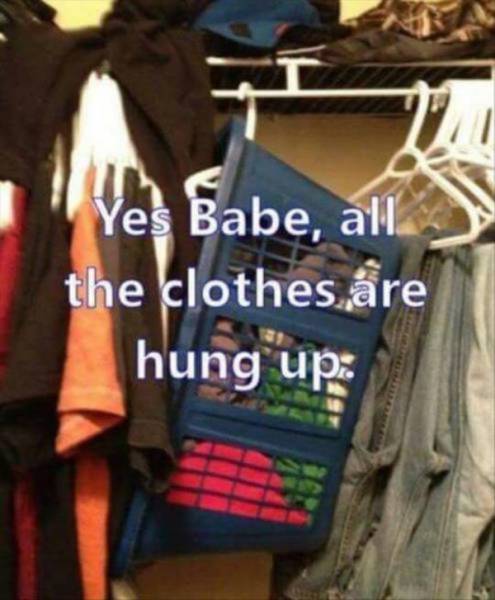
Locate an element on the screen. This screenshot has width=495, height=600. clothes on shelf is located at coordinates (447, 16), (164, 20).